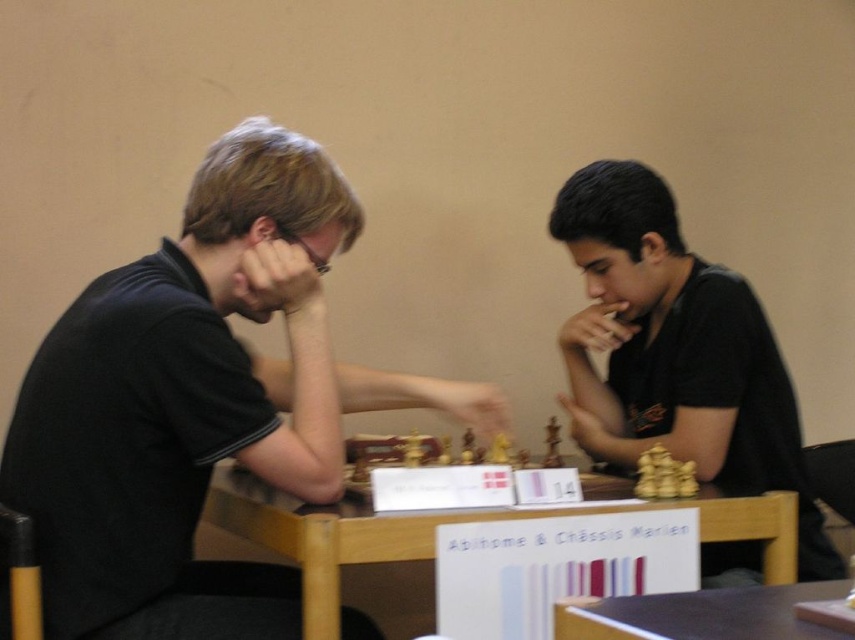
Question: Which object appears closest to the camera in this image?

Choices:
 (A) brown wooden table at lower center
 (B) wooden chess set at center
 (C) black matte shirt at left

Answer: (A)

Question: Does brown wooden table at lower center appear on the right side of wooden chess set at center?

Choices:
 (A) no
 (B) yes

Answer: (B)

Question: Which object is closer to the camera taking this photo?

Choices:
 (A) wooden at center
 (B) black matte shirt at center
 (C) wooden chess set at center

Answer: (A)

Question: Is black matte shirt at center to the left of wooden chess set at center from the viewer's perspective?

Choices:
 (A) no
 (B) yes

Answer: (A)

Question: Can you confirm if wooden at center is bigger than wooden chess set at center?

Choices:
 (A) no
 (B) yes

Answer: (B)

Question: Which of the following is the farthest from the observer?

Choices:
 (A) wooden chess set at center
 (B) wooden at center
 (C) black matte shirt at left
 (D) brown wooden table at lower center

Answer: (A)